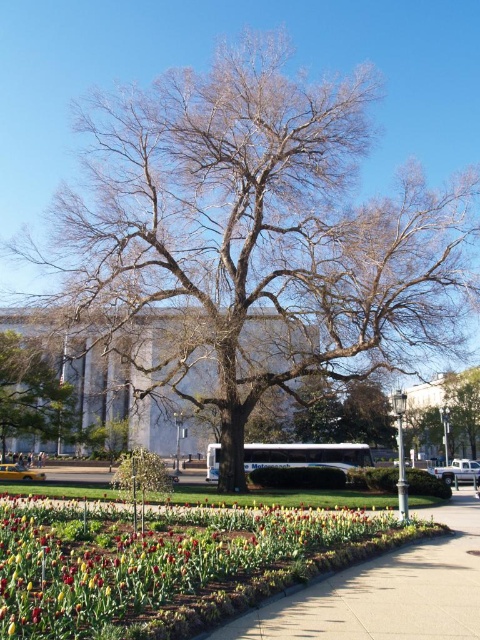
Consider the image. You are standing on the paved pathway and want to walk towards the flower bed. Which direction should you go relative to the bare wood tree at center and the green leafy tree at center?

The bare wood tree at center is to the right of the green leafy tree at center. To reach the flower bed, you should walk to the left of the green leafy tree at center, as the flower bed is positioned in front of both trees and the pathway curves around them.

You are a gardener planning to plant a new tree in the garden. You see the bare wood tree at center and the green leafy tree at center. Which one is larger in size?

The bare wood tree at center is bigger than the green leafy tree at center.